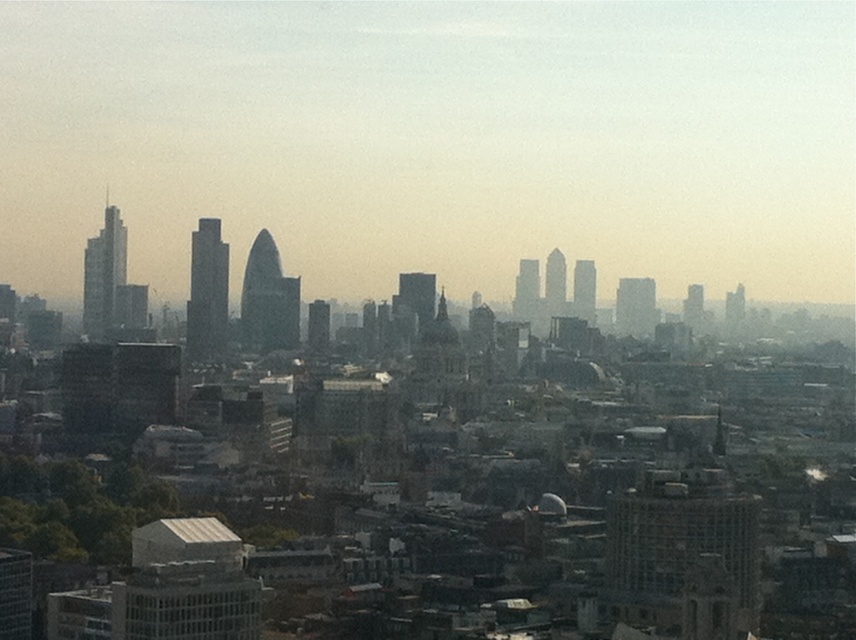
Question: Is matte glass skyscrapers at center thinner than glassy gray skyscraper at center?

Choices:
 (A) yes
 (B) no

Answer: (B)

Question: Is the position of matte glass skyscrapers at center more distant than that of glassy gray skyscraper at center?

Choices:
 (A) yes
 (B) no

Answer: (B)

Question: Which point is closer to the camera?

Choices:
 (A) matte glass skyscrapers at center
 (B) glassy gray skyscraper at center

Answer: (A)

Question: Does matte glass skyscrapers at center lie in front of glassy gray skyscraper at center?

Choices:
 (A) no
 (B) yes

Answer: (B)